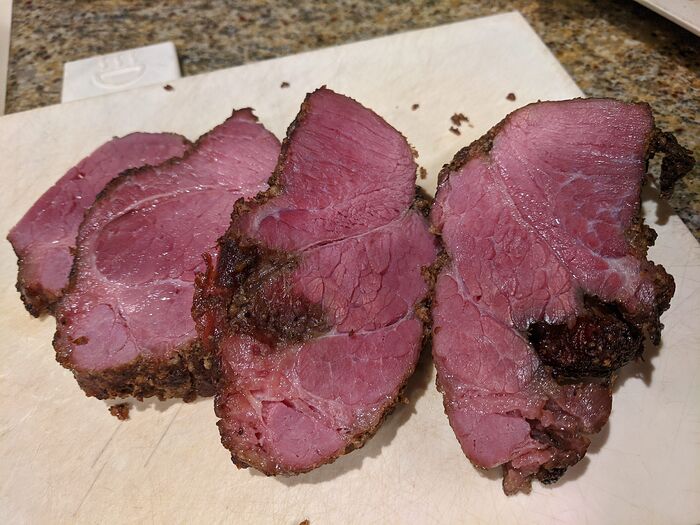
Find the location of `crumb`. crumb is located at coordinates (456, 120).